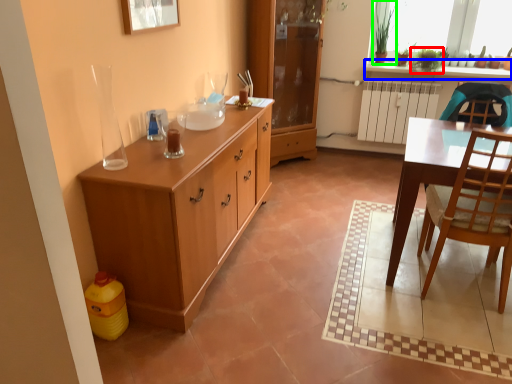
Question: Considering the real-world distances, which object is closest to houseplant (highlighted by a red box)? counter top (highlighted by a blue box) or houseplant (highlighted by a green box).

Choices:
 (A) counter top
 (B) houseplant

Answer: (A)